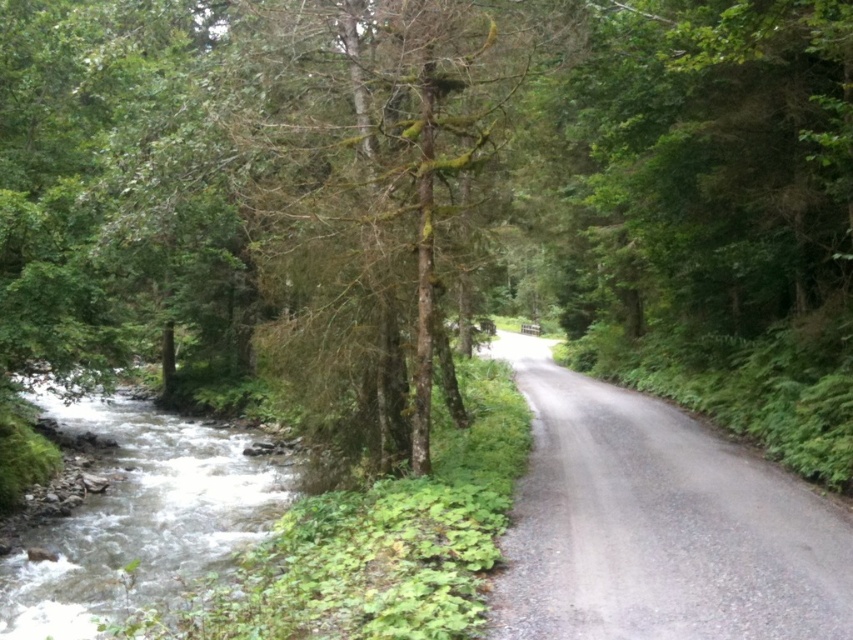
Is gray gravel road at center thinner than clear water at stream left?

Correct, gray gravel road at center's width is less than clear water at stream left's.

Which is behind, point (511, 561) or point (71, 422)?

Positioned behind is point (71, 422).

Between point (579, 541) and point (30, 605), which one is positioned in front?

Point (579, 541)

You are a GUI agent. You are given a task and a screenshot of the screen. Output one action in this format:
    pyautogui.click(x=<x>, y=<y>)
    Task: Click on the gray gravel road at center
    The height and width of the screenshot is (640, 853).
    Given the screenshot: What is the action you would take?
    pyautogui.click(x=657, y=524)

Which is behind, point (428, 115) or point (90, 627)?

The point (428, 115) is more distant.

Does green mossy tree at center have a larger size compared to clear water at stream left?

Actually, green mossy tree at center might be smaller than clear water at stream left.

Does point (344, 268) come behind point (45, 621)?

That is True.

Where is `green mossy tree at center`? This screenshot has width=853, height=640. green mossy tree at center is located at coordinates (363, 198).

Which is more to the left, green mossy tree at center or gray gravel road at center?

From the viewer's perspective, green mossy tree at center appears more on the left side.

Is green mossy tree at center smaller than gray gravel road at center?

Yes, green mossy tree at center is smaller than gray gravel road at center.

At what (x,y) coordinates should I click in order to perform the action: click on green mossy tree at center. Please return your answer as a coordinate pair (x, y). The width and height of the screenshot is (853, 640). Looking at the image, I should click on (363, 198).

Identify the location of green mossy tree at center. The width and height of the screenshot is (853, 640). (363, 198).